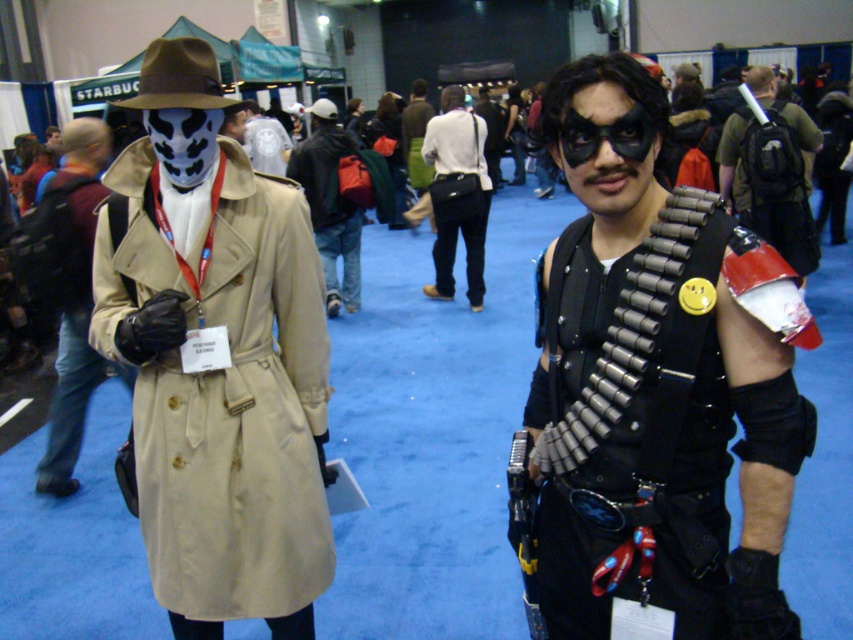
Is matte black mask at center closer to camera compared to white cotton shirt at center?

Yes.

Who is more distant from viewer, (44,228) or (460,204)?

The point (460,204) is behind.

Where is `matte black mask at center`? The height and width of the screenshot is (640, 853). matte black mask at center is located at coordinates tap(73, 296).

Does white cotton shirt at center appear on the right side of white matte mask at center?

Correct, you'll find white cotton shirt at center to the right of white matte mask at center.

Who is taller, white cotton shirt at center or white matte mask at center?

white cotton shirt at center is taller.

The image size is (853, 640). I want to click on white cotton shirt at center, so click(x=466, y=193).

Does beige fabric trench coat at left appear over matte black mask at center?

Actually, beige fabric trench coat at left is below matte black mask at center.

Between point (204, 630) and point (88, 300), which one is positioned behind?

Point (88, 300)

Where is `beige fabric trench coat at left`? beige fabric trench coat at left is located at coordinates (216, 358).